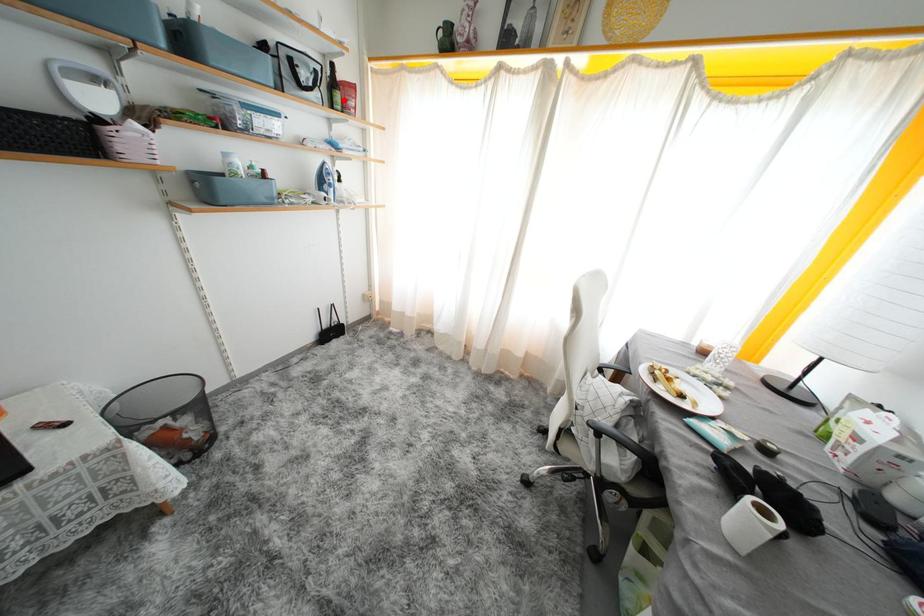
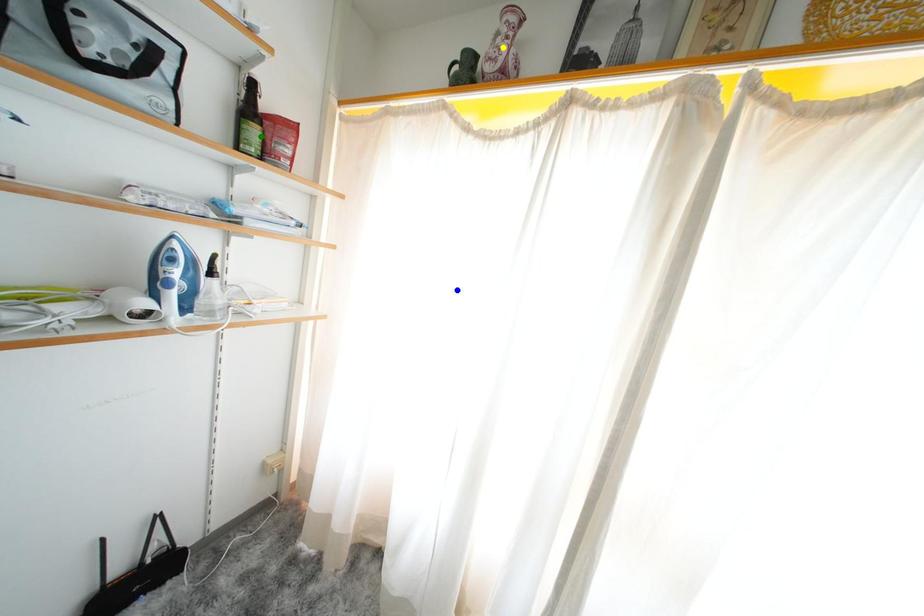
Question: I am providing you with two images of the same scene from different viewpoints. A red point is marked on the first image. You are given multiple points on the second image. Which spot in image 2 lines up with the point in image 1?

Choices:
 (A) green point
 (B) blue point
 (C) yellow point

Answer: (A)